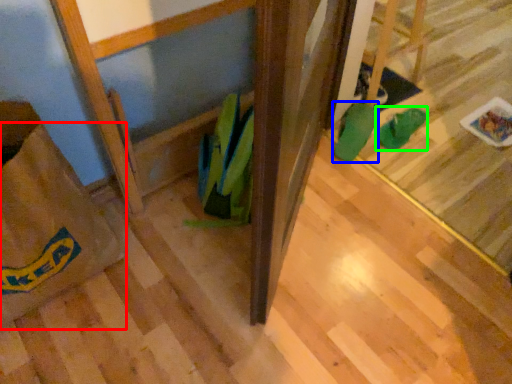
Question: Which is nearer to the grocery bag (highlighted by a red box)? footwear (highlighted by a blue box) or footwear (highlighted by a green box).

Choices:
 (A) footwear
 (B) footwear

Answer: (A)